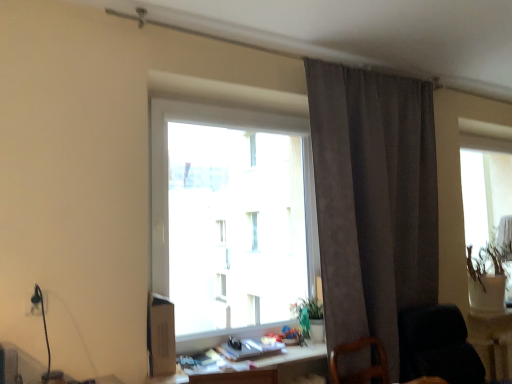
Question: Looking at their shapes, would you say black fabric rocking chair at lower right is wider or thinner than wooden desk at lower center, the first table from the front?

Choices:
 (A) wide
 (B) thin

Answer: (A)

Question: Considering the positions of point (437, 362) and point (292, 347), is point (437, 362) closer or farther from the camera than point (292, 347)?

Choices:
 (A) farther
 (B) closer

Answer: (A)

Question: Which of these objects is positioned farthest from the wooden table at lower right, the 1th table when ordered from back to front?

Choices:
 (A) transparent glass window at center
 (B) wooden desk at lower center, arranged as the first table when viewed from the left
 (C) black fabric rocking chair at lower right
 (D) suede-like gray curtain at upper right
 (E) green matte vase at right

Answer: (A)

Question: Which object is the farthest from the suede-like gray curtain at upper right?

Choices:
 (A) transparent glass window at center
 (B) wooden desk at lower center, which is counted as the second table, starting from the right
 (C) black fabric rocking chair at lower right
 (D) green matte vase at right
 (E) wooden table at lower right, marked as the first table in a right-to-left arrangement

Answer: (D)